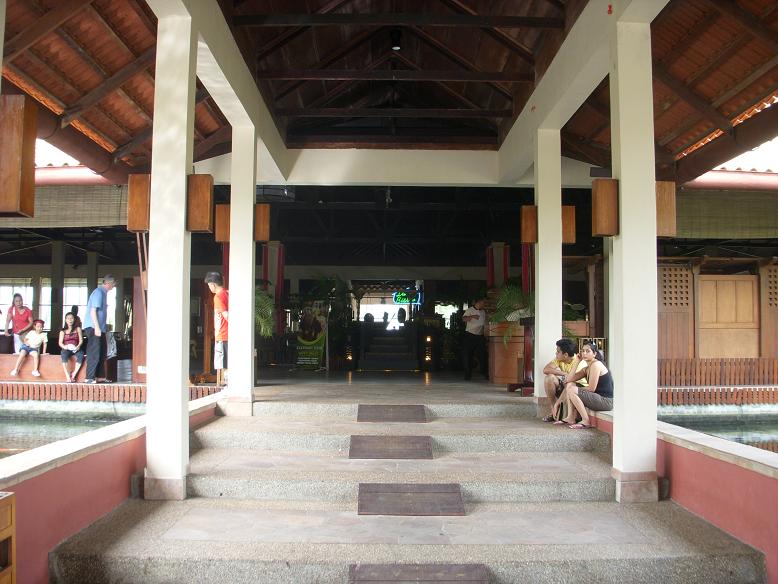
Find the location of a particular element. This screenshot has height=584, width=778. bamboo shade is located at coordinates (81, 210), (722, 228).